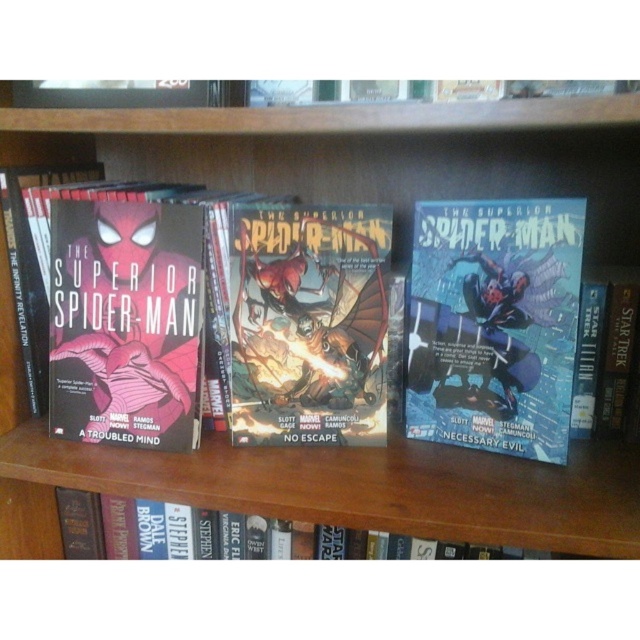
Looking at this image, you are standing 1 meter away from the wooden bookshelf. There is a point at coordinates point (525,451) on the bookshelf. Can you reach this point with your hand?

The distance of point (525,451) from viewer is 69.73 centimeters. Since you are standing 1 meter away, which is 100 centimeters, the total distance to the point is 169.73 centimeters. Most people cannot reach that far with their hand, so it might be difficult.

You are a collector who wants to place a new comic book between the matte black comic book at center and the hardcover book at lower center. Can you fit it there?

The matte black comic book at center is closer to the viewer than the hardcover book at lower center, so there might be space between them to fit a new comic book.